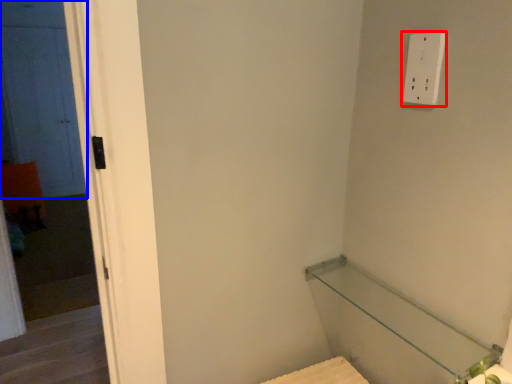
Question: Which of the following is the closest to the observer, light switch (highlighted by a red box) or door (highlighted by a blue box)?

Choices:
 (A) light switch
 (B) door

Answer: (A)